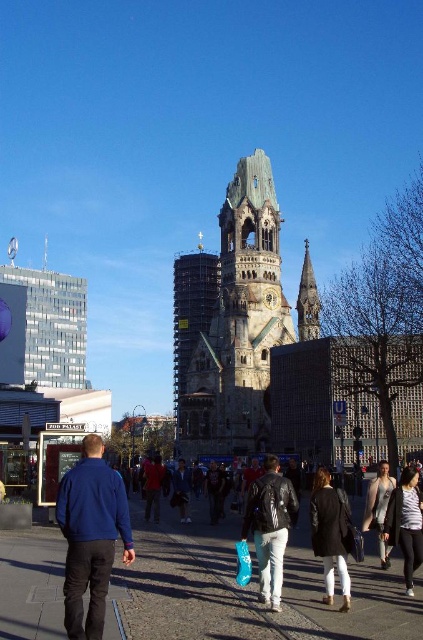
Identify the location of glassy reflective skyscraper at left. (52, 324).

Does glassy reflective skyscraper at left have a lesser width compared to smooth stone spire at center?

No, glassy reflective skyscraper at left is not thinner than smooth stone spire at center.

Is point (68, 340) less distant than point (312, 326)?

That is False.

Where is `glassy reflective skyscraper at left`? The height and width of the screenshot is (640, 423). glassy reflective skyscraper at left is located at coordinates (52, 324).

Who is more distant from viewer, (200, 452) or (315, 529)?

The point (200, 452) is behind.

Is stone clock tower at center taller than black leather jacket at center?

Correct, stone clock tower at center is much taller as black leather jacket at center.

You are a GUI agent. You are given a task and a screenshot of the screen. Output one action in this format:
    pyautogui.click(x=<x>, y=<y>)
    Task: Click on the stone clock tower at center
    The image size is (423, 640).
    Given the screenshot: What is the action you would take?
    pyautogui.click(x=238, y=324)

In order to click on stone clock tower at center in this screenshot , I will do `click(238, 324)`.

Does glassy reflective skyscraper at left have a lesser width compared to dark brown stone tower at center?

No, glassy reflective skyscraper at left is not thinner than dark brown stone tower at center.

In the scene shown: Is glassy reflective skyscraper at left to the right of dark brown stone tower at center from the viewer's perspective?

In fact, glassy reflective skyscraper at left is to the left of dark brown stone tower at center.

The image size is (423, 640). Describe the element at coordinates (52, 324) in the screenshot. I see `glassy reflective skyscraper at left` at that location.

Identify the location of glassy reflective skyscraper at left. The width and height of the screenshot is (423, 640). (52, 324).